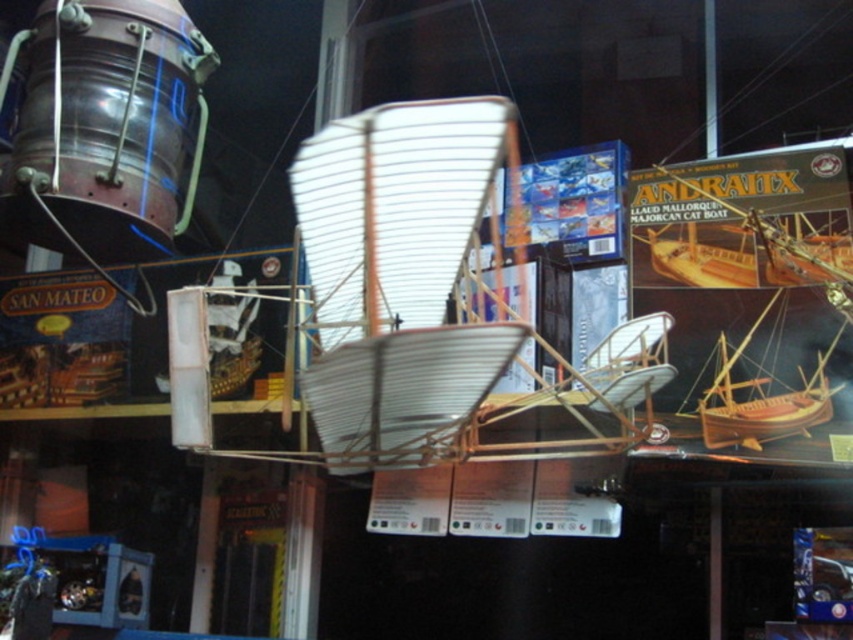
Question: Which of the following is the farthest from the observer?

Choices:
 (A) (28, 132)
 (B) (817, 365)

Answer: (A)

Question: Does metallic drum at upper left have a greater width compared to wooden polished boat at center?

Choices:
 (A) yes
 (B) no

Answer: (A)

Question: Which object is farther from the camera taking this photo?

Choices:
 (A) wooden polished boat at center
 (B) metallic drum at upper left

Answer: (B)

Question: Among these objects, which one is farthest from the camera?

Choices:
 (A) metallic drum at upper left
 (B) wooden polished boat at center

Answer: (A)

Question: Is metallic drum at upper left to the left of wooden polished boat at center from the viewer's perspective?

Choices:
 (A) no
 (B) yes

Answer: (B)

Question: Can you confirm if metallic drum at upper left is positioned to the right of wooden polished boat at center?

Choices:
 (A) yes
 (B) no

Answer: (B)